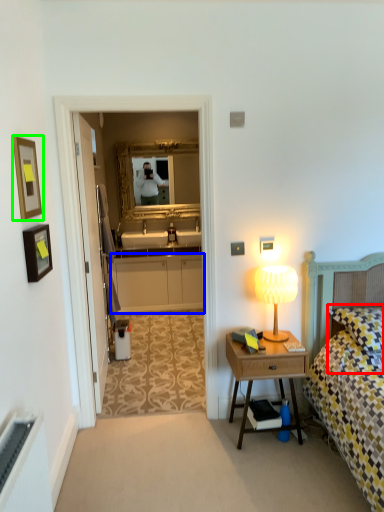
Question: Considering the real-world distances, which object is farthest from pillow (highlighted by a red box)? cabinetry (highlighted by a blue box) or picture frame (highlighted by a green box)?

Choices:
 (A) cabinetry
 (B) picture frame

Answer: (A)